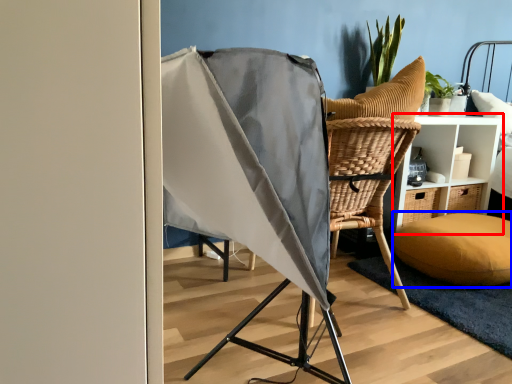
Question: Which of the following is the farthest to the observer, furniture (highlighted by a red box) or pillow (highlighted by a blue box)?

Choices:
 (A) furniture
 (B) pillow

Answer: (A)